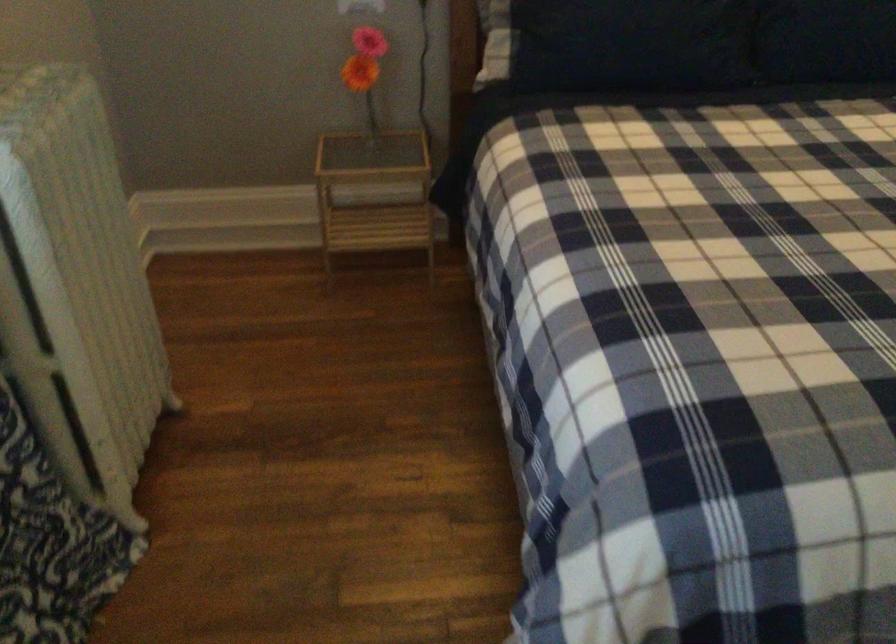
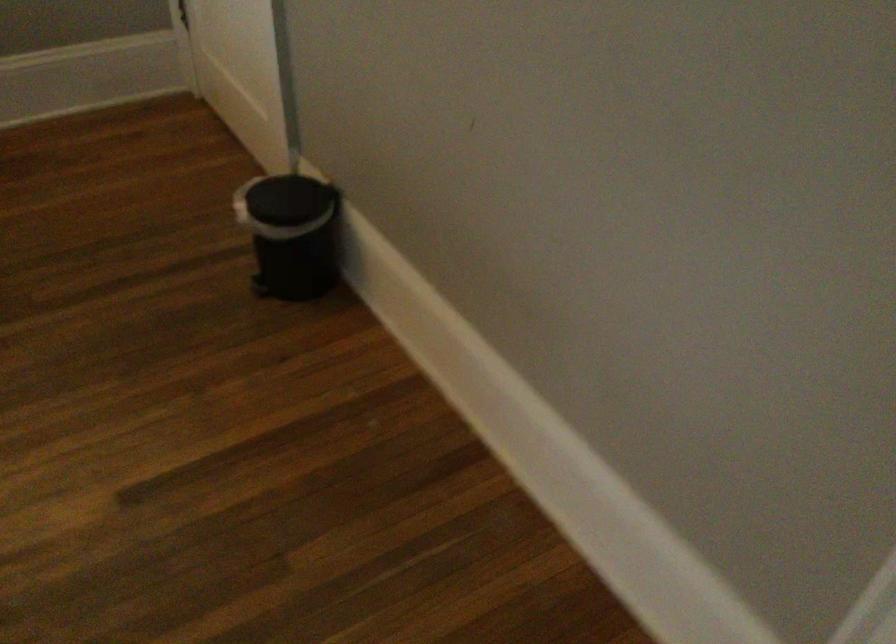
Question: Which direction would the cameraman need to move to produce the second image? Reply with the corresponding letter.

Choices:
 (A) Left
 (B) Right
 (C) Forward
 (D) Backward

Answer: (B)